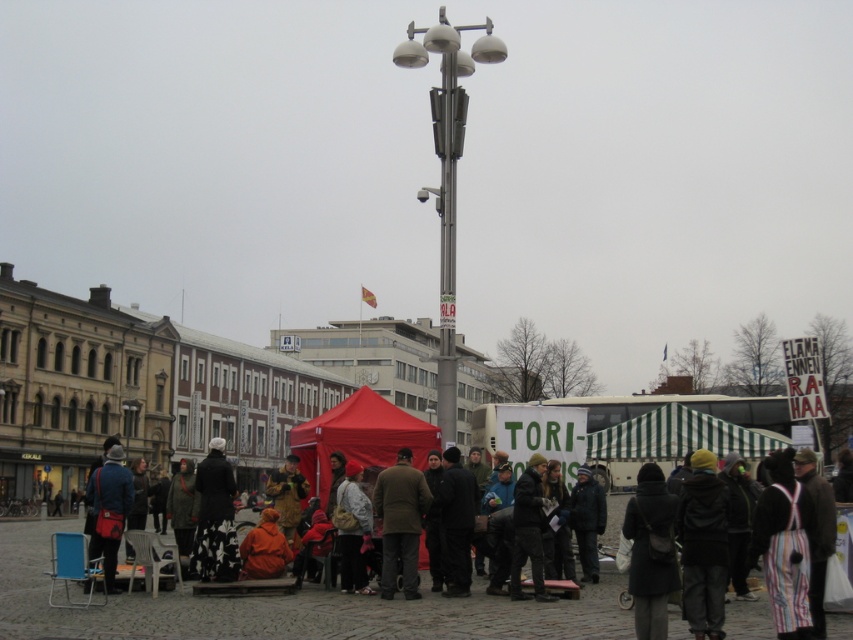
Question: In this image, where is metallic gray pole at center located relative to floral-patterned coat at center?

Choices:
 (A) right
 (B) left

Answer: (A)

Question: Is dark brown coat at center smaller than floral-patterned coat at center?

Choices:
 (A) no
 (B) yes

Answer: (B)

Question: Can you confirm if dark brown coat at center is bigger than matte blue jacket at lower left?

Choices:
 (A) no
 (B) yes

Answer: (A)

Question: Among these objects, which one is farthest from the camera?

Choices:
 (A) dark gray wool coat at lower center
 (B) orange fabric tent at center

Answer: (B)

Question: Which is nearer to the matte red tent at center?

Choices:
 (A) matte blue jacket at lower left
 (B) metallic gray streetlamp at center
 (C) orange fabric jacket at lower center

Answer: (C)

Question: Among these objects, which one is nearest to the camera?

Choices:
 (A) dark brown coat at center
 (B) matte red tent at center

Answer: (A)